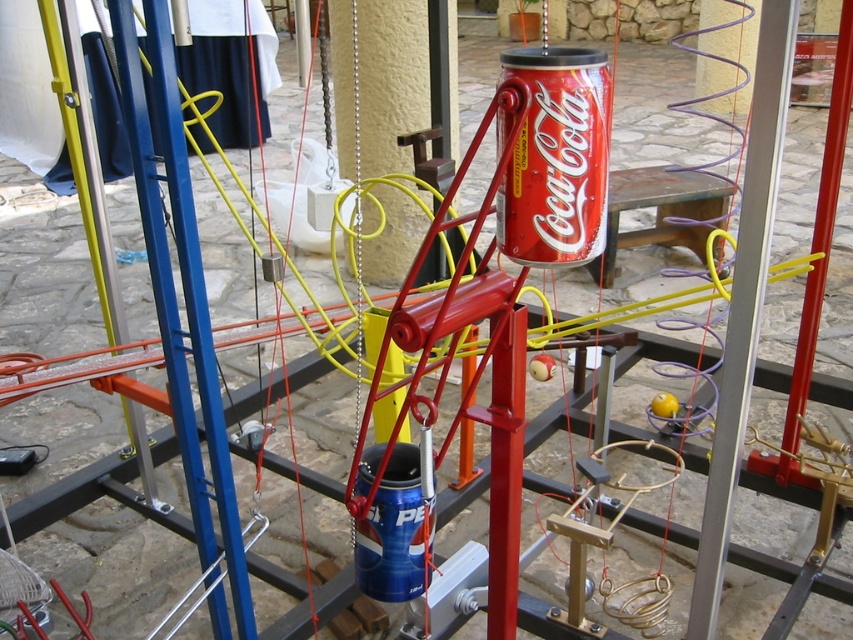
Does red matte coca-cola can at center appear on the left side of blue metallic pole at left?

In fact, red matte coca-cola can at center is to the right of blue metallic pole at left.

Who is higher up, red matte coca-cola can at center or blue metallic pole at left?

red matte coca-cola can at center is higher up.

Find the location of a particular element. The height and width of the screenshot is (640, 853). red matte coca-cola can at center is located at coordinates (556, 157).

Find the location of a particular element. This screenshot has width=853, height=640. red matte coca-cola can at center is located at coordinates (556, 157).

Between red matte coca-cola can at center and silver metallic pole at center, which one appears on the left side from the viewer's perspective?

Answer: Positioned to the left is red matte coca-cola can at center.

Does red matte coca-cola can at center appear under silver metallic pole at center?

Incorrect, red matte coca-cola can at center is not positioned below silver metallic pole at center.

What do you see at coordinates (556, 157) in the screenshot?
I see `red matte coca-cola can at center` at bounding box center [556, 157].

Find the location of `red matte coca-cola can at center`. red matte coca-cola can at center is located at coordinates (556, 157).

Is red matte coca-cola can at center positioned at the back of metallic red pole at center?

No, it is in front of metallic red pole at center.

Does point (500, 118) lie behind point (787, 413)?

That is False.

Describe the element at coordinates (556, 157) in the screenshot. This screenshot has width=853, height=640. I see `red matte coca-cola can at center` at that location.

Image resolution: width=853 pixels, height=640 pixels. Find the location of `red matte coca-cola can at center`. red matte coca-cola can at center is located at coordinates (556, 157).